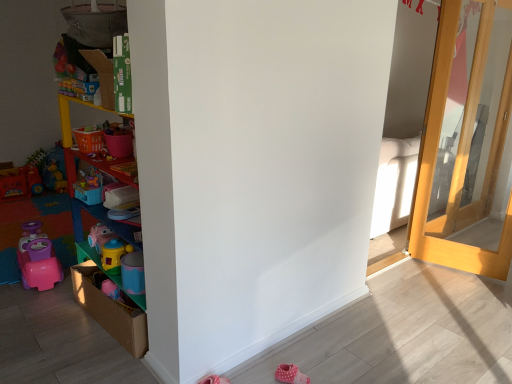
Locate an element on the screen. This screenshot has height=384, width=512. vacant space situated on the left part of multicolored plastic shelves at left is located at coordinates [x=56, y=329].